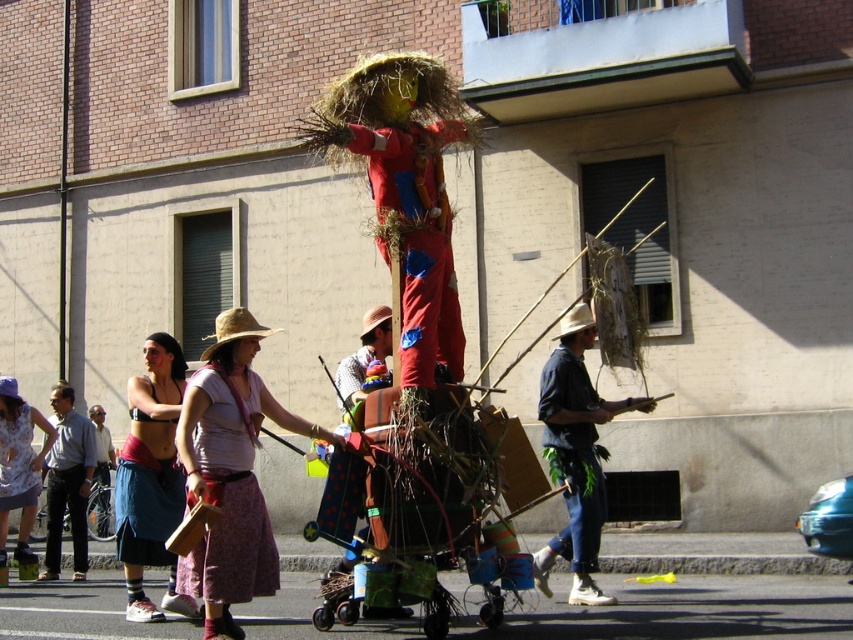
Question: Observing the image, what is the correct spatial positioning of matte gray shirt at center in reference to matte straw hat at center?

Choices:
 (A) below
 (B) above

Answer: (A)

Question: Which point is farther from the camera taking this photo?

Choices:
 (A) (200, 394)
 (B) (563, 340)

Answer: (B)

Question: Observing the image, what is the correct spatial positioning of printed cotton dress at lower left in reference to light brown wooden cane at center?

Choices:
 (A) right
 (B) left

Answer: (A)

Question: Can you confirm if denim jeans at center is wider than matte gray shirt at center?

Choices:
 (A) yes
 (B) no

Answer: (A)

Question: Among these objects, which one is nearest to the camera?

Choices:
 (A) matte pink fabric dress at center
 (B) matte black tank top at center

Answer: (A)

Question: Which of the following is the farthest from the observer?

Choices:
 (A) (18, 556)
 (B) (152, 380)

Answer: (A)